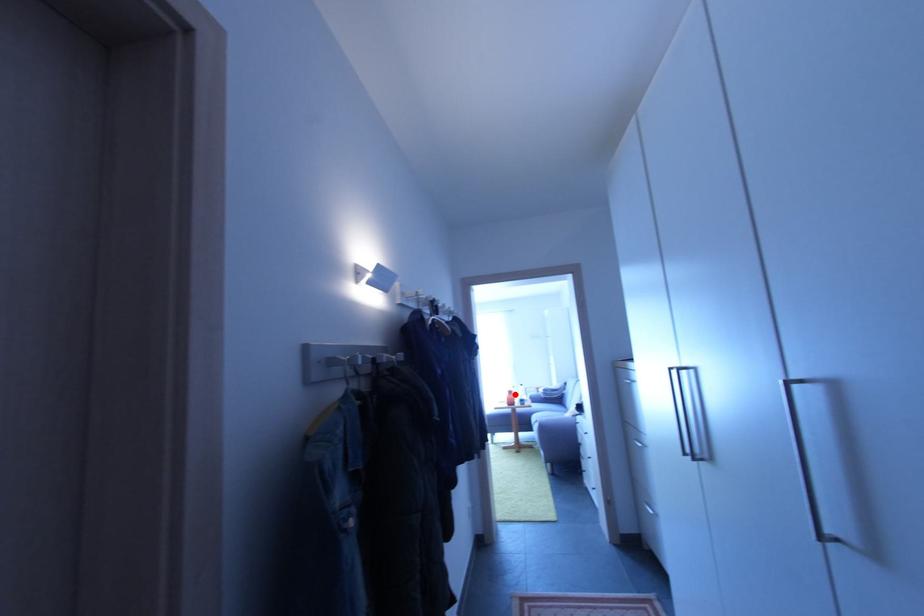
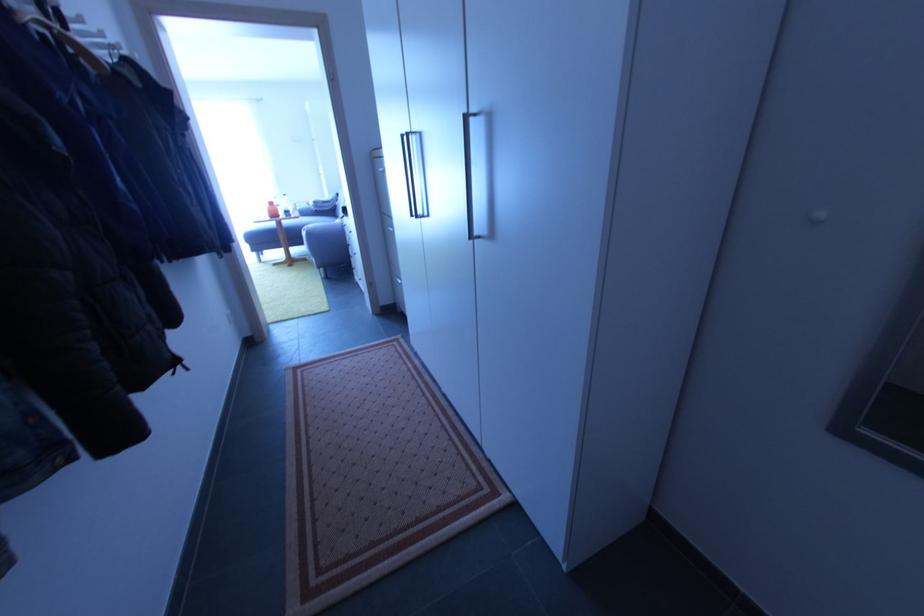
Find the pixel in the second image that matches the highlighted location in the first image.

(275, 205)